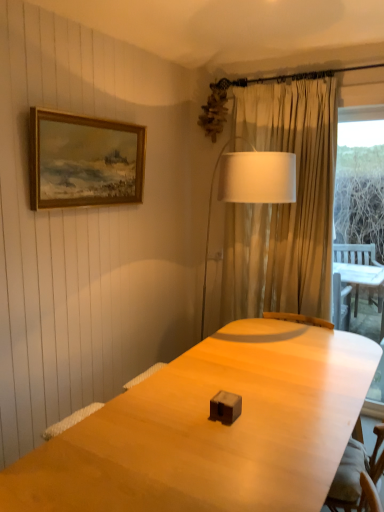
Question: Does wooden framed painting at upper left have a smaller size compared to white fabric lampshade at center?

Choices:
 (A) yes
 (B) no

Answer: (A)

Question: Can you confirm if wooden framed painting at upper left is wider than white fabric lampshade at center?

Choices:
 (A) no
 (B) yes

Answer: (A)

Question: From the image's perspective, does wooden framed painting at upper left appear higher than white fabric lampshade at center?

Choices:
 (A) no
 (B) yes

Answer: (B)

Question: Is wooden framed painting at upper left taller than white fabric lampshade at center?

Choices:
 (A) no
 (B) yes

Answer: (A)

Question: From the image's perspective, is wooden framed painting at upper left under white fabric lampshade at center?

Choices:
 (A) no
 (B) yes

Answer: (A)

Question: Is wooden framed painting at upper left not within white fabric lampshade at center?

Choices:
 (A) no
 (B) yes

Answer: (B)

Question: From the image's perspective, is white fabric lampshade at center over wooden framed painting at upper left?

Choices:
 (A) no
 (B) yes

Answer: (A)

Question: From a real-world perspective, is white fabric lampshade at center over wooden framed painting at upper left?

Choices:
 (A) no
 (B) yes

Answer: (A)

Question: Is white fabric lampshade at center facing towards wooden framed painting at upper left?

Choices:
 (A) yes
 (B) no

Answer: (B)

Question: Considering the relative sizes of white fabric lampshade at center and wooden framed painting at upper left in the image provided, is white fabric lampshade at center taller than wooden framed painting at upper left?

Choices:
 (A) no
 (B) yes

Answer: (B)

Question: Is white fabric lampshade at center oriented away from wooden framed painting at upper left?

Choices:
 (A) yes
 (B) no

Answer: (B)

Question: Considering the relative sizes of white fabric lampshade at center and wooden framed painting at upper left in the image provided, is white fabric lampshade at center thinner than wooden framed painting at upper left?

Choices:
 (A) yes
 (B) no

Answer: (B)

Question: Is white fabric lampshade at center in front of or behind wooden framed painting at upper left in the image?

Choices:
 (A) behind
 (B) front

Answer: (A)